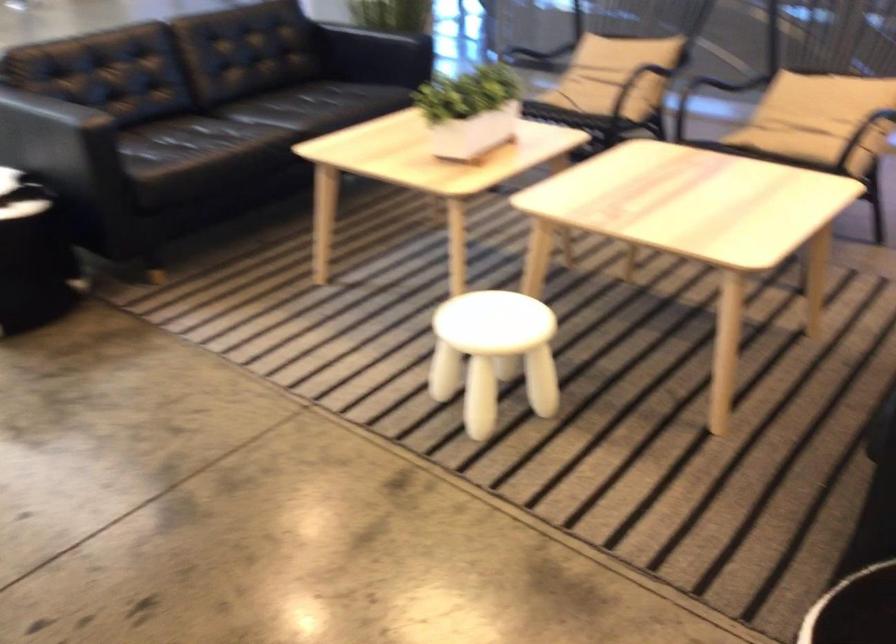
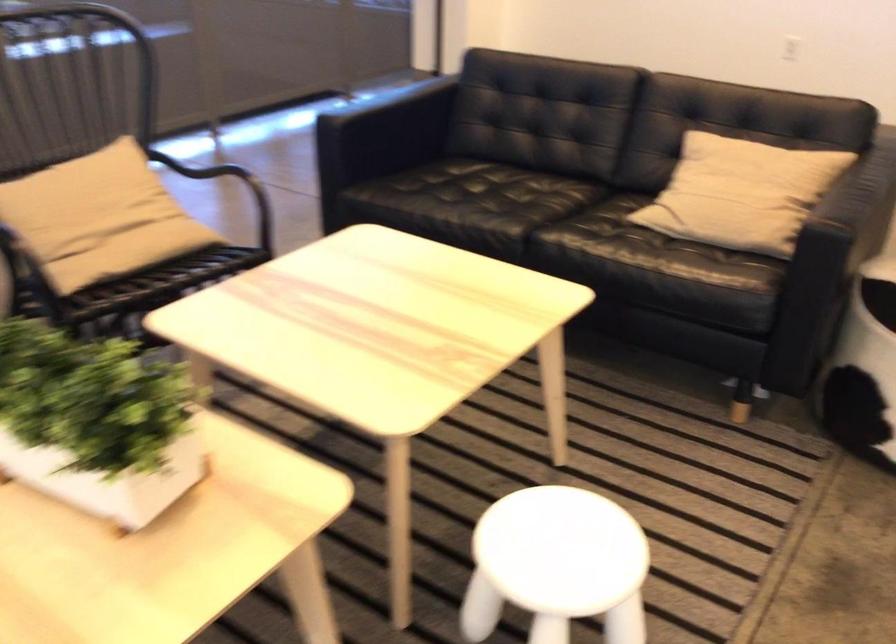
In the second image, find the point that corresponds to the point at 807,98 in the first image.

(99, 214)